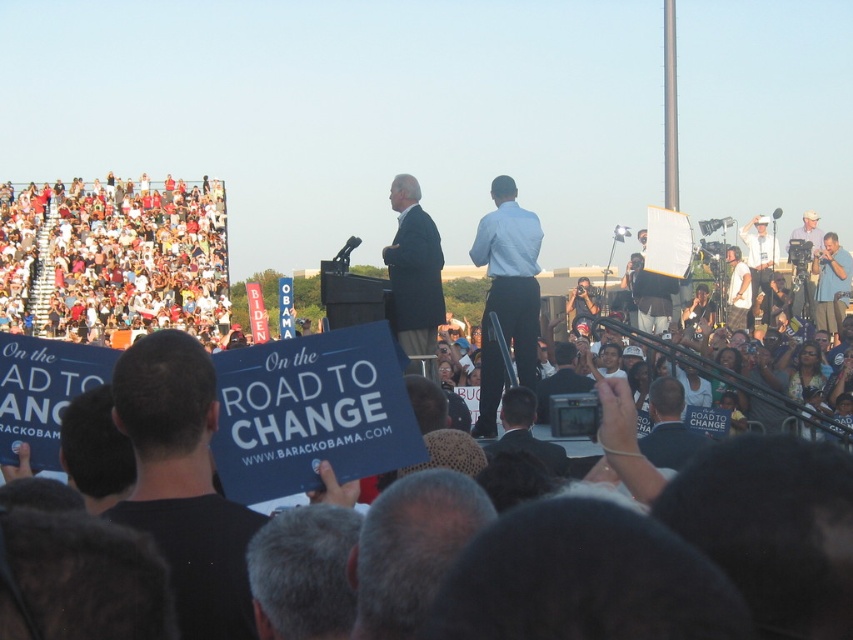
Who is positioned more to the right, dark blue shirt at center or dark gray suit at center?

dark blue shirt at center is more to the right.

Does dark blue shirt at center lie in front of dark gray suit at center?

That is False.

Is point (682, 454) positioned before point (525, 445)?

Yes, it is.

This screenshot has width=853, height=640. I want to click on dark blue shirt at center, so click(668, 426).

Does point (158, 260) come in front of point (379, 592)?

That is False.

Is white cotton crowd at upper left further to the viewer compared to gray hair at center?

Yes, it is.

Where is `white cotton crowd at upper left`? white cotton crowd at upper left is located at coordinates (112, 257).

Image resolution: width=853 pixels, height=640 pixels. Find the location of `white cotton crowd at upper left`. white cotton crowd at upper left is located at coordinates (112, 257).

Who is shorter, gray hair at center or dark gray suit at center?

dark gray suit at center

Can you confirm if gray hair at center is bigger than dark gray suit at center?

Yes.

Identify the location of gray hair at center. (410, 548).

At what (x,y) coordinates should I click in order to perform the action: click on gray hair at center. Please return your answer as a coordinate pair (x, y). The image size is (853, 640). Looking at the image, I should click on (410, 548).